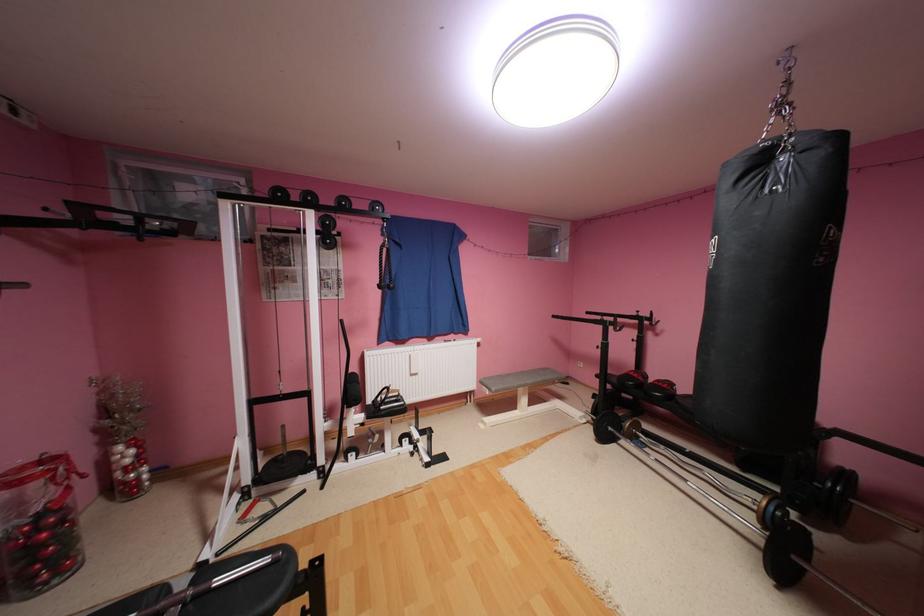
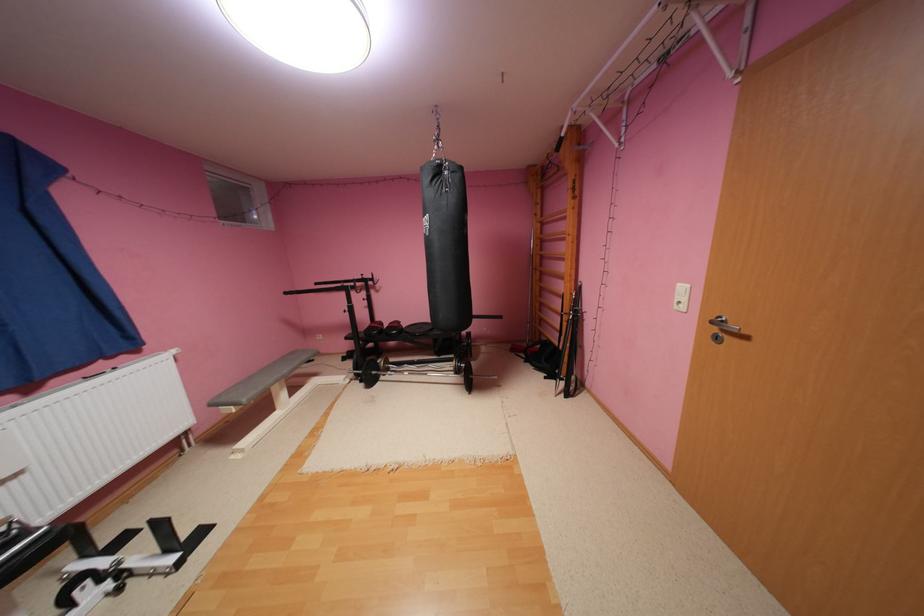
Locate, in the second image, the point that corresponds to (x=769, y=161) in the first image.

(446, 171)